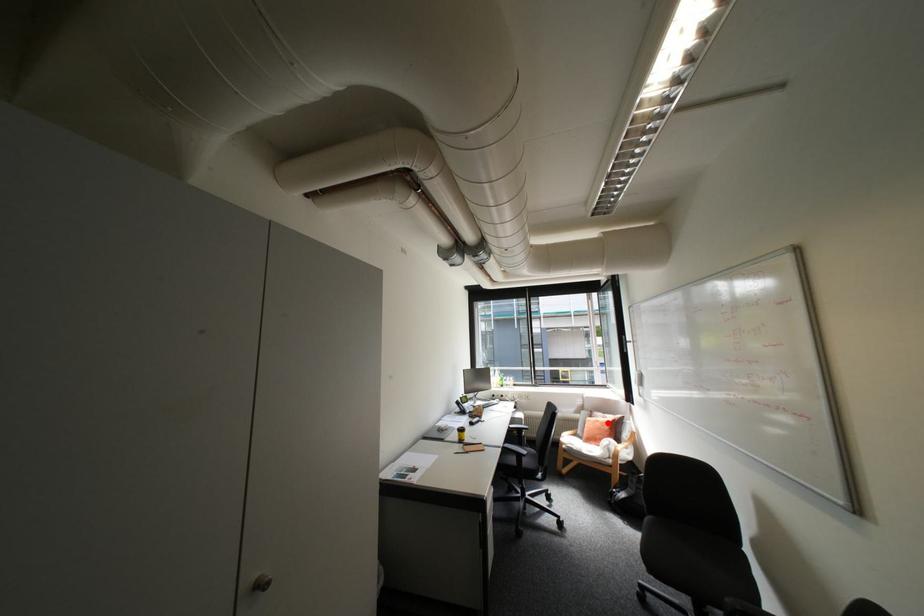
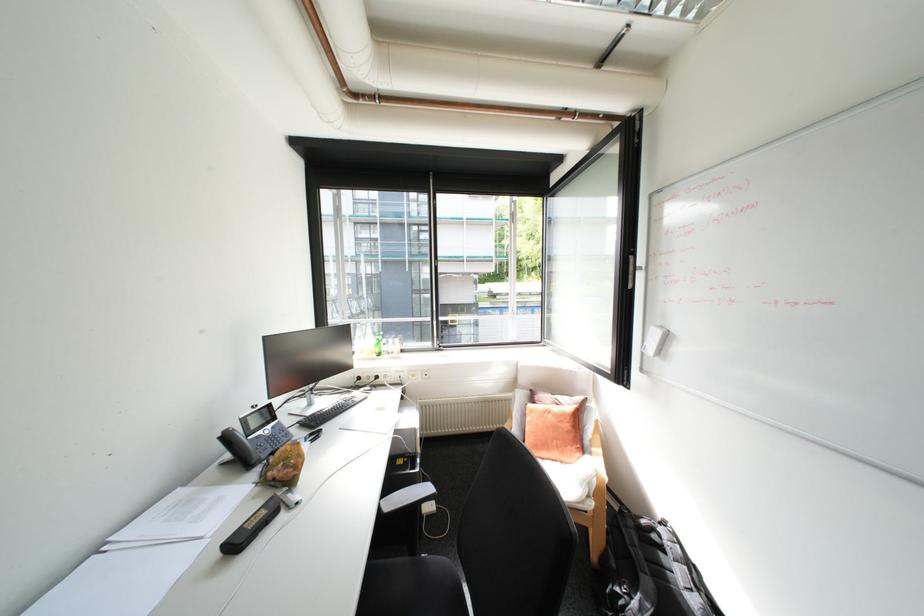
In the second image, find the point that corresponds to the highlighted location in the first image.

(561, 416)